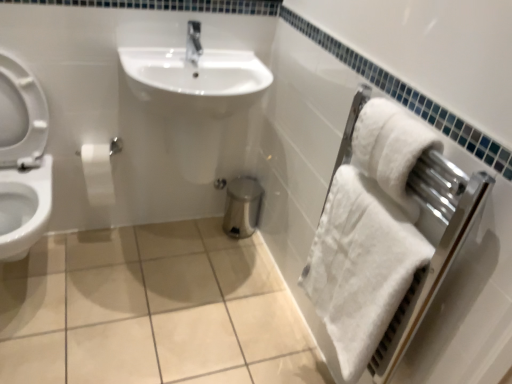
Identify the location of vacant area that is situated to the right of white glossy toilet at left. This screenshot has height=384, width=512. (98, 293).